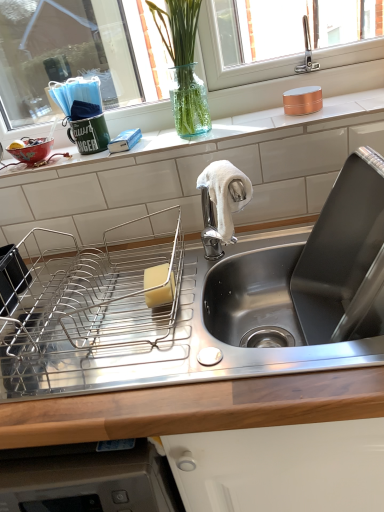
Find the location of `unoccupied region to the right of copper metallic canister at upper right, positioned as the first appliance in top-to-bottom order`. unoccupied region to the right of copper metallic canister at upper right, positioned as the first appliance in top-to-bottom order is located at coordinates (350, 101).